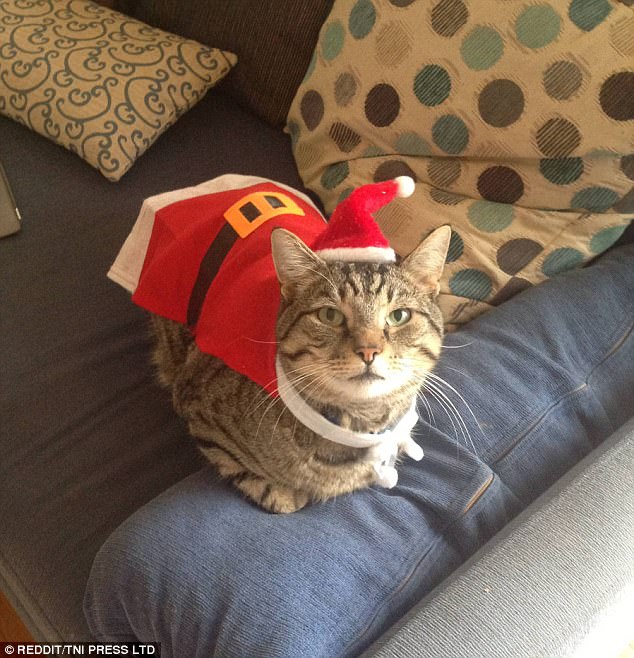
Find the location of a particular element. This screenshot has width=634, height=658. pillow is located at coordinates (96, 64).